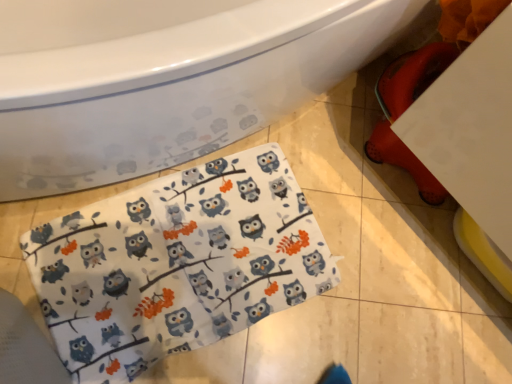
The width and height of the screenshot is (512, 384). What do you see at coordinates (177, 264) in the screenshot?
I see `white fabric with owl print at lower center` at bounding box center [177, 264].

Consider the image. In order to face white fabric with owl print at lower center, should I rotate leftwards or rightwards?

A 8.876 degree turn to the left will do.

Identify the location of white fabric with owl print at lower center. This screenshot has height=384, width=512. (177, 264).

Image resolution: width=512 pixels, height=384 pixels. In order to click on white glossy bathtub at upper left in this screenshot , I will do `click(165, 80)`.

The image size is (512, 384). Describe the element at coordinates (165, 80) in the screenshot. I see `white glossy bathtub at upper left` at that location.

Locate an element on the screen. Image resolution: width=512 pixels, height=384 pixels. white fabric with owl print at lower center is located at coordinates (177, 264).

Which object is positioned more to the right, white glossy bathtub at upper left or white fabric with owl print at lower center?

white fabric with owl print at lower center.

Which is behind, white glossy bathtub at upper left or white fabric with owl print at lower center?

white fabric with owl print at lower center is behind.

Between point (130, 78) and point (31, 276), which one is positioned behind?

Point (31, 276)

From the image's perspective, relative to white fabric with owl print at lower center, is white glossy bathtub at upper left above or below?

Clearly, from the image's perspective, white glossy bathtub at upper left is above white fabric with owl print at lower center.

From a real-world perspective, who is located lower, white glossy bathtub at upper left or white fabric with owl print at lower center?

In real-world perspective, white fabric with owl print at lower center is lower.

Can you confirm if white glossy bathtub at upper left is thinner than white fabric with owl print at lower center?

No, white glossy bathtub at upper left is not thinner than white fabric with owl print at lower center.

Considering the sizes of white glossy bathtub at upper left and white fabric with owl print at lower center in the image, is white glossy bathtub at upper left taller or shorter than white fabric with owl print at lower center?

Clearly, white glossy bathtub at upper left is taller compared to white fabric with owl print at lower center.

Between white glossy bathtub at upper left and white fabric with owl print at lower center, which one has smaller size?

white fabric with owl print at lower center is smaller.

Is white fabric with owl print at lower center located within white glossy bathtub at upper left?

Actually, white fabric with owl print at lower center is outside white glossy bathtub at upper left.

Is white glossy bathtub at upper left touching white fabric with owl print at lower center?

white glossy bathtub at upper left and white fabric with owl print at lower center are clearly separated.

Is white glossy bathtub at upper left facing away from white fabric with owl print at lower center?

white glossy bathtub at upper left is not turned away from white fabric with owl print at lower center.

What's the angular difference between white glossy bathtub at upper left and white fabric with owl print at lower center's facing directions?

There is a 2.4-degree angle between the facing directions of white glossy bathtub at upper left and white fabric with owl print at lower center.

Measure the distance between white glossy bathtub at upper left and white fabric with owl print at lower center.

They are 13.62 inches apart.

In the image, there is a white glossy bathtub at upper left. Where is `baby clothe below it (from the image's perspective)`? This screenshot has width=512, height=384. baby clothe below it (from the image's perspective) is located at coordinates (177, 264).

Can you confirm if white fabric with owl print at lower center is positioned to the right of white glossy bathtub at upper left?

Yes.

Considering their positions, is white fabric with owl print at lower center located in front of or behind white glossy bathtub at upper left?

white fabric with owl print at lower center is positioned farther from the viewer than white glossy bathtub at upper left.

Which is behind, point (132, 235) or point (119, 68)?

The point (132, 235) is behind.

From the image's perspective, between white fabric with owl print at lower center and white glossy bathtub at upper left, which one is located above?

white glossy bathtub at upper left is shown above in the image.

From a real-world perspective, which is physically above, white fabric with owl print at lower center or white glossy bathtub at upper left?

From a 3D spatial view, white glossy bathtub at upper left is above.

Does white fabric with owl print at lower center have a lesser width compared to white glossy bathtub at upper left?

Correct, the width of white fabric with owl print at lower center is less than that of white glossy bathtub at upper left.

Between white fabric with owl print at lower center and white glossy bathtub at upper left, which one has more height?

With more height is white glossy bathtub at upper left.

Does white fabric with owl print at lower center have a smaller size compared to white glossy bathtub at upper left?

Yes, white fabric with owl print at lower center is smaller than white glossy bathtub at upper left.

Is white fabric with owl print at lower center outside of white glossy bathtub at upper left?

Yes.

Are white fabric with owl print at lower center and white glossy bathtub at upper left located far from each other?

No.

Is white fabric with owl print at lower center looking in the opposite direction of white glossy bathtub at upper left?

Correct, white fabric with owl print at lower center is looking away from white glossy bathtub at upper left.

Find the location of a particular element. baby clothe that appears on the right of white glossy bathtub at upper left is located at coordinates (177, 264).

In order to click on bathtub above the white fabric with owl print at lower center (from the image's perspective) in this screenshot , I will do `click(165, 80)`.

Locate an element on the screen. bathtub that is above the white fabric with owl print at lower center (from a real-world perspective) is located at coordinates click(165, 80).